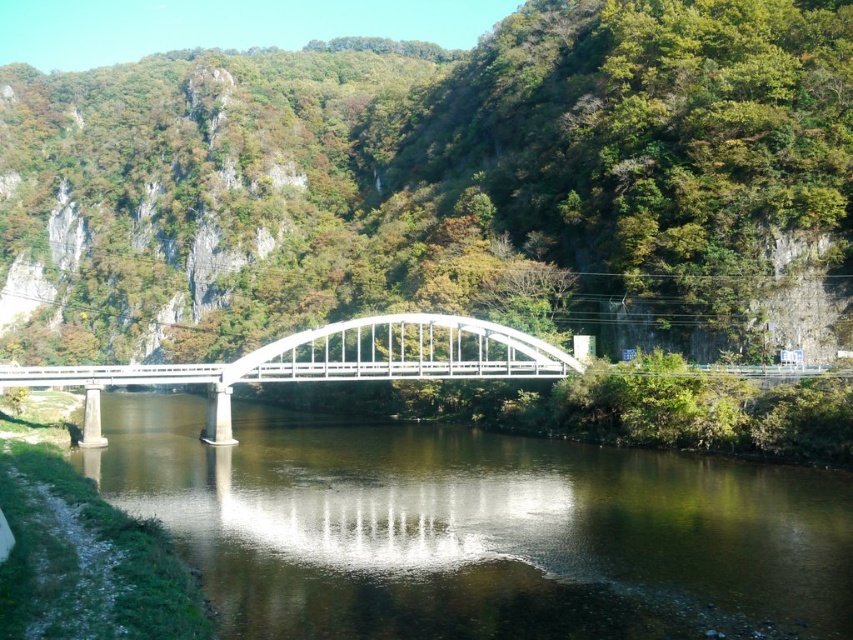
Question: Is greenish-brown water at center in front of white metallic bridge at center?

Choices:
 (A) yes
 (B) no

Answer: (A)

Question: Does greenish-brown water at center have a smaller size compared to white metallic bridge at center?

Choices:
 (A) no
 (B) yes

Answer: (B)

Question: Does greenish-brown water at center appear on the left side of white metallic bridge at center?

Choices:
 (A) yes
 (B) no

Answer: (B)

Question: Which object appears farthest from the camera in this image?

Choices:
 (A) white metallic bridge at center
 (B) greenish-brown water at center

Answer: (A)